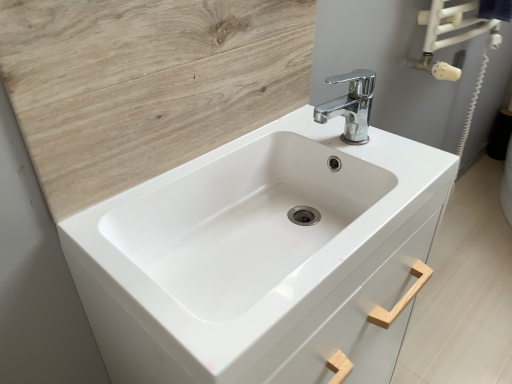
Where is `white wood drawer at center`? This screenshot has width=512, height=384. white wood drawer at center is located at coordinates (366, 321).

What do you see at coordinates (262, 258) in the screenshot? I see `white glossy sink at center` at bounding box center [262, 258].

What do you see at coordinates (145, 84) in the screenshot? I see `wooden at upper left` at bounding box center [145, 84].

What do you see at coordinates (350, 105) in the screenshot? I see `chrome metallic faucet at upper center` at bounding box center [350, 105].

Where is `white wood drawer at center`? The width and height of the screenshot is (512, 384). white wood drawer at center is located at coordinates (366, 321).

From a real-world perspective, who is located lower, wooden at upper left or white glossy sink at center?

white glossy sink at center is physically lower.

Is wooden at upper left not within white glossy sink at center?

Yes, wooden at upper left is located beyond the bounds of white glossy sink at center.

Can you tell me how much wooden at upper left and white glossy sink at center differ in facing direction?

0.397 degrees separate the facing orientations of wooden at upper left and white glossy sink at center.

Is wooden at upper left aimed at white glossy sink at center?

No, wooden at upper left does not turn towards white glossy sink at center.

Consider the image. From the image's perspective, is chrome metallic faucet at upper center located above white wood drawer at center?

Yes, from the image's perspective, chrome metallic faucet at upper center is on top of white wood drawer at center.

Is chrome metallic faucet at upper center shorter than white wood drawer at center?

No, chrome metallic faucet at upper center is not shorter than white wood drawer at center.

Based on the photo, does chrome metallic faucet at upper center lie behind white wood drawer at center?

No, chrome metallic faucet at upper center is closer to the camera.

In the scene shown: How much distance is there between chrome metallic faucet at upper center and white wood drawer at center?

13.35 inches.

Consider the image. Does wooden at upper left turn towards chrome metallic faucet at upper center?

Yes, wooden at upper left is aimed at chrome metallic faucet at upper center.

Is wooden at upper left positioned in front of chrome metallic faucet at upper center?

That is True.

Does point (290, 56) come closer to viewer compared to point (357, 123)?

That is True.

Can you confirm if wooden at upper left is bigger than chrome metallic faucet at upper center?

Yes.

Considering the relative positions of white glossy sink at center and chrome metallic faucet at upper center in the image provided, is white glossy sink at center to the right of chrome metallic faucet at upper center from the viewer's perspective?

In fact, white glossy sink at center is to the left of chrome metallic faucet at upper center.

The image size is (512, 384). Find the location of `sink on the left side of chrome metallic faucet at upper center`. sink on the left side of chrome metallic faucet at upper center is located at coordinates (262, 258).

How different are the orientations of white glossy sink at center and chrome metallic faucet at upper center in degrees?

white glossy sink at center and chrome metallic faucet at upper center are facing 90 degrees away from each other.

From the picture: Would you say chrome metallic faucet at upper center is part of white glossy sink at center's contents?

That's incorrect, chrome metallic faucet at upper center is not inside white glossy sink at center.

Considering the positions of point (3, 46) and point (410, 279), is point (3, 46) closer or farther from the camera than point (410, 279)?

Point (3, 46).

Is wooden at upper left facing towards white wood drawer at center?

No, wooden at upper left is not turned towards white wood drawer at center.

From the picture: Does wooden at upper left lie behind white wood drawer at center?

No, it is in front of white wood drawer at center.

From the image's perspective, who appears lower, chrome metallic faucet at upper center or white glossy sink at center?

white glossy sink at center appears lower in the image.

From the picture: Considering the sizes of objects chrome metallic faucet at upper center and white glossy sink at center in the image provided, who is shorter, chrome metallic faucet at upper center or white glossy sink at center?

With less height is chrome metallic faucet at upper center.

Is chrome metallic faucet at upper center far away from white glossy sink at center?

chrome metallic faucet at upper center is actually quite close to white glossy sink at center.

Is white glossy sink at center bigger or smaller than white wood drawer at center?

Considering their sizes, white glossy sink at center takes up more space than white wood drawer at center.

Is white glossy sink at center next to white wood drawer at center and touching it?

No, white glossy sink at center is not beside white wood drawer at center.

From a real-world perspective, is white glossy sink at center positioned above or below white wood drawer at center?

From a real-world perspective, white glossy sink at center is physically above white wood drawer at center.

You are a GUI agent. You are given a task and a screenshot of the screen. Output one action in this format:
    pyautogui.click(x=<x>, y=<y>)
    Task: Click on the drawer behind the white glossy sink at center
    
    Given the screenshot: What is the action you would take?
    pyautogui.click(x=366, y=321)

This screenshot has width=512, height=384. I want to click on plywood behind the white glossy sink at center, so [x=145, y=84].

At what (x,y) coordinates should I click in order to perform the action: click on tap in front of the white wood drawer at center. Please return your answer as a coordinate pair (x, y). Looking at the image, I should click on (350, 105).

When comparing their distances from chrome metallic faucet at upper center, does white glossy sink at center or wooden at upper left seem closer?

Based on the image, white glossy sink at center appears to be nearer to chrome metallic faucet at upper center.

From the image, which object appears to be nearer to wooden at upper left, chrome metallic faucet at upper center or white glossy sink at center?

white glossy sink at center is closer to wooden at upper left.

When comparing their distances from white wood drawer at center, does wooden at upper left or white glossy sink at center seem further?

Based on the image, wooden at upper left appears to be further to white wood drawer at center.

Which object lies further to the anchor point wooden at upper left, white wood drawer at center or chrome metallic faucet at upper center?

Based on the image, white wood drawer at center appears to be further to wooden at upper left.

Considering their positions, is wooden at upper left positioned closer to chrome metallic faucet at upper center than white glossy sink at center?

white glossy sink at center is positioned closer to the anchor chrome metallic faucet at upper center.

Consider the image. When comparing their distances from chrome metallic faucet at upper center, does white glossy sink at center or white wood drawer at center seem further?

white wood drawer at center is positioned further to the anchor chrome metallic faucet at upper center.

Considering their positions, is white glossy sink at center positioned further to white wood drawer at center than chrome metallic faucet at upper center?

Among the two, chrome metallic faucet at upper center is located further to white wood drawer at center.

Looking at this image, based on their spatial positions, is wooden at upper left or white wood drawer at center closer to white glossy sink at center?

Among the two, white wood drawer at center is located nearer to white glossy sink at center.

Find the location of a particular element. Image resolution: width=512 pixels, height=384 pixels. tap between wooden at upper left and white wood drawer at center from left to right is located at coordinates tap(350, 105).

Locate an element on the screen. The width and height of the screenshot is (512, 384). sink between wooden at upper left and white wood drawer at center is located at coordinates (262, 258).

Image resolution: width=512 pixels, height=384 pixels. I want to click on tap between white glossy sink at center and white wood drawer at center, so click(x=350, y=105).

I want to click on tap between wooden at upper left and white glossy sink at center in the vertical direction, so point(350,105).